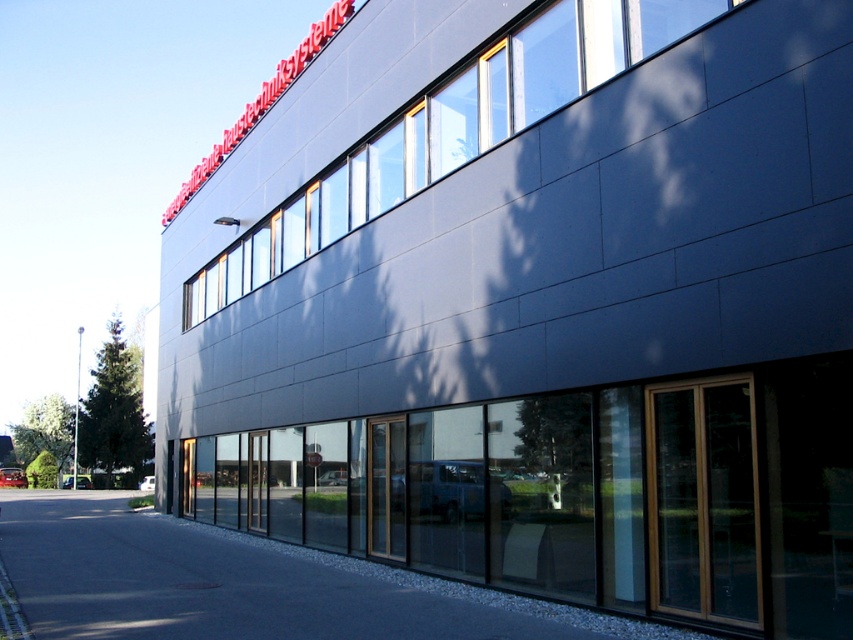
Is gray asphalt pavement at lower center wider than slate gray glass windows at upper center?

Correct, the width of gray asphalt pavement at lower center exceeds that of slate gray glass windows at upper center.

Is gray asphalt pavement at lower center closer to the viewer compared to slate gray glass windows at upper center?

Yes, gray asphalt pavement at lower center is closer to the viewer.

Find the location of a particular element. The width and height of the screenshot is (853, 640). gray asphalt pavement at lower center is located at coordinates (244, 582).